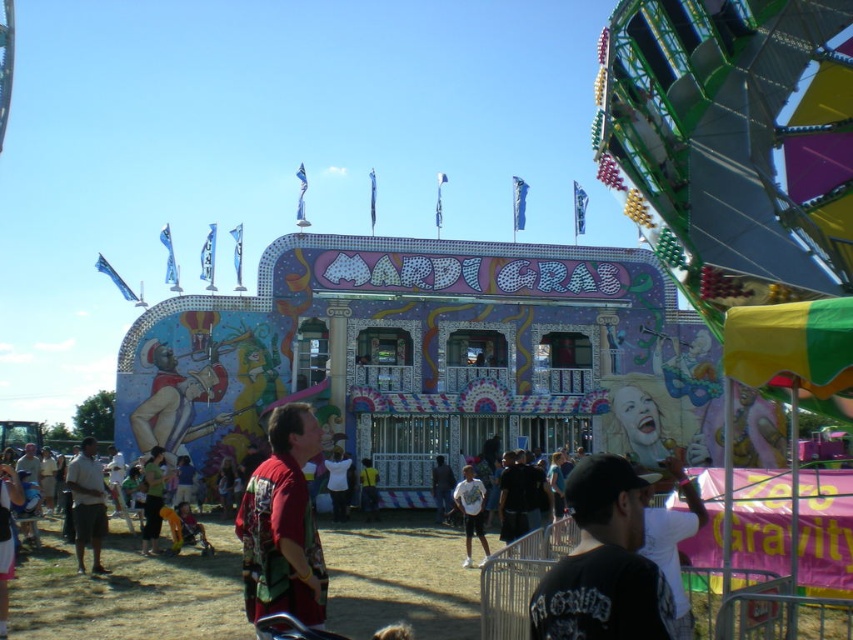
Question: Does red fabric shirt at center have a smaller size compared to green fabric dress at center?

Choices:
 (A) yes
 (B) no

Answer: (B)

Question: Among these points, which one is nearest to the camera?

Choices:
 (A) (144, 515)
 (B) (364, 480)

Answer: (B)

Question: Which object is the closest to the white matte shirt at center?

Choices:
 (A) yellow fabric at center
 (B) red fabric shirt at center
 (C) dark gray shorts at lower left

Answer: (A)

Question: Which of the following is the farthest from the observer?

Choices:
 (A) (604, 502)
 (B) (102, 506)

Answer: (B)

Question: Can you confirm if green fabric dress at center is thinner than yellow fabric at center?

Choices:
 (A) yes
 (B) no

Answer: (B)

Question: Does dark gray shorts at lower left appear under white matte shirt at center?

Choices:
 (A) no
 (B) yes

Answer: (A)